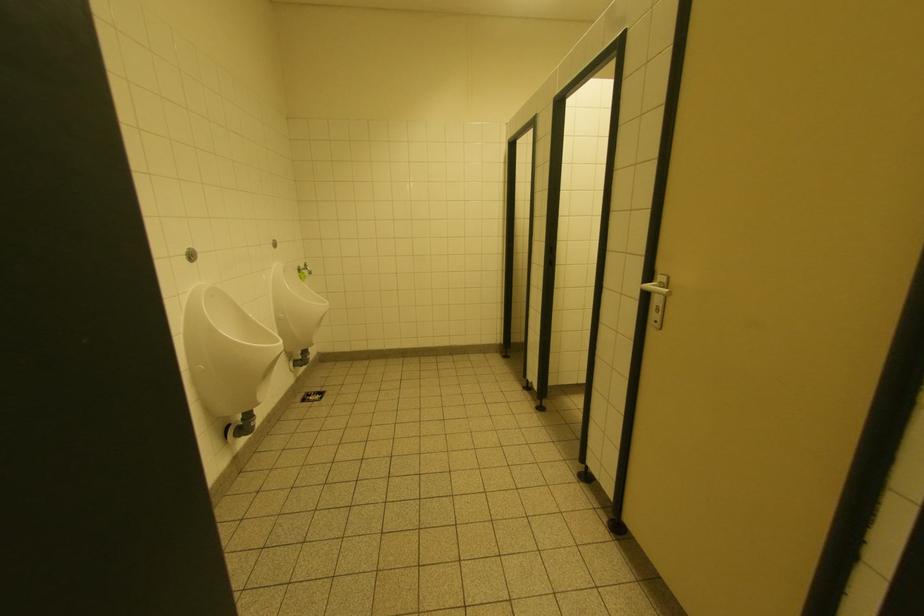
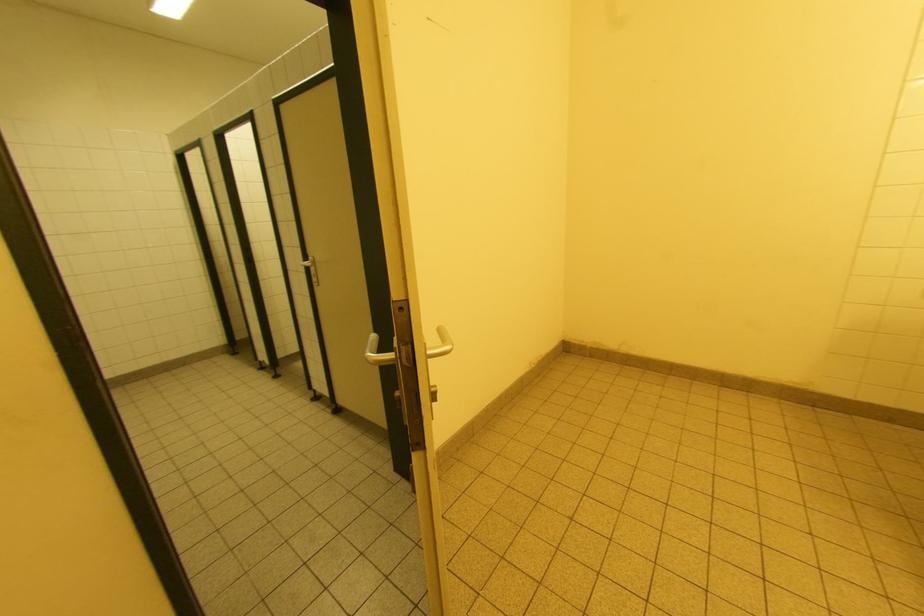
Question: The first image is from the beginning of the video and the second image is from the end. How did the camera likely rotate when shooting the video?

Choices:
 (A) Left
 (B) Right
 (C) Up
 (D) Down

Answer: (B)